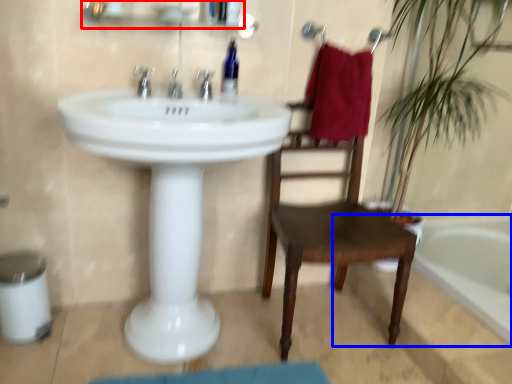
Question: Among these objects, which one is nearest to the camera, medicine cabinet (highlighted by a red box) or bathtub (highlighted by a blue box)?

Choices:
 (A) medicine cabinet
 (B) bathtub

Answer: (A)